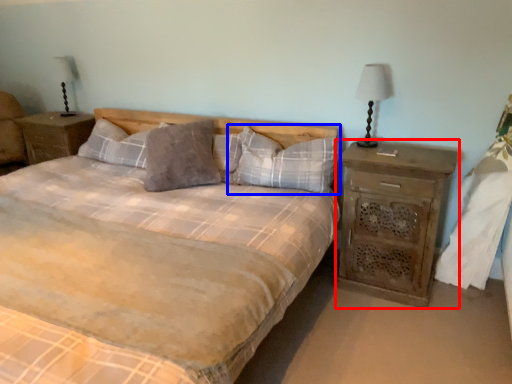
Question: Which object is further to the camera taking this photo, nightstand (highlighted by a red box) or pillow (highlighted by a blue box)?

Choices:
 (A) nightstand
 (B) pillow

Answer: (B)